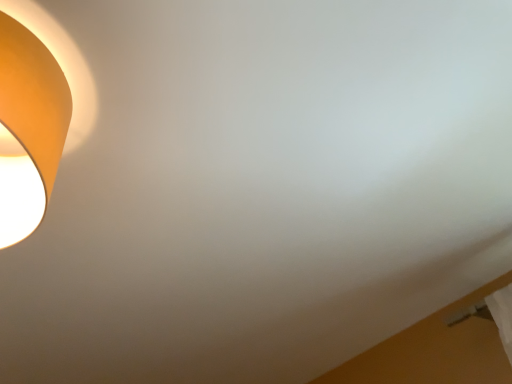
The width and height of the screenshot is (512, 384). In order to click on matte yellow lampshade at left in this screenshot , I will do `click(28, 128)`.

In order to face matte yellow lampshade at left, should I rotate leftwards or rightwards?

Turn left approximately 30.284 degrees to face it.

Describe the element at coordinates (28, 128) in the screenshot. I see `matte yellow lampshade at left` at that location.

Identify the location of matte yellow lampshade at left. The image size is (512, 384). (28, 128).